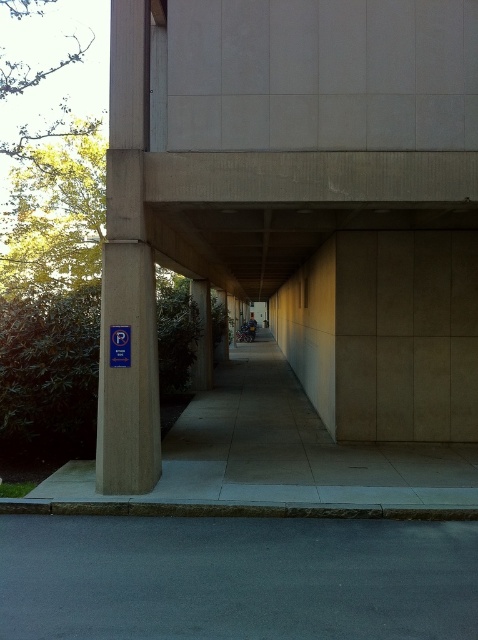
Question: Can you confirm if gray concrete pavement at center is positioned above beige concrete pillar at left?

Choices:
 (A) yes
 (B) no

Answer: (B)

Question: Which point is closer to the camera?

Choices:
 (A) (119, 337)
 (B) (457, 465)

Answer: (A)

Question: Considering the real-world distances, which object is closest to the dark gray asphalt at lower center?

Choices:
 (A) shiny silver motorbike at center
 (B) beige concrete pillar at left

Answer: (B)

Question: Does concrete corridor at center have a larger size compared to shiny silver motorbike at center?

Choices:
 (A) yes
 (B) no

Answer: (A)

Question: Does gray concrete pavement at center appear under shiny silver motorbike at center?

Choices:
 (A) yes
 (B) no

Answer: (A)

Question: Estimate the real-world distances between objects in this image. Which object is farther from the shiny silver motorbike at center?

Choices:
 (A) dark gray asphalt at lower center
 (B) concrete corridor at center
 (C) blue plastic parking sign at left

Answer: (A)